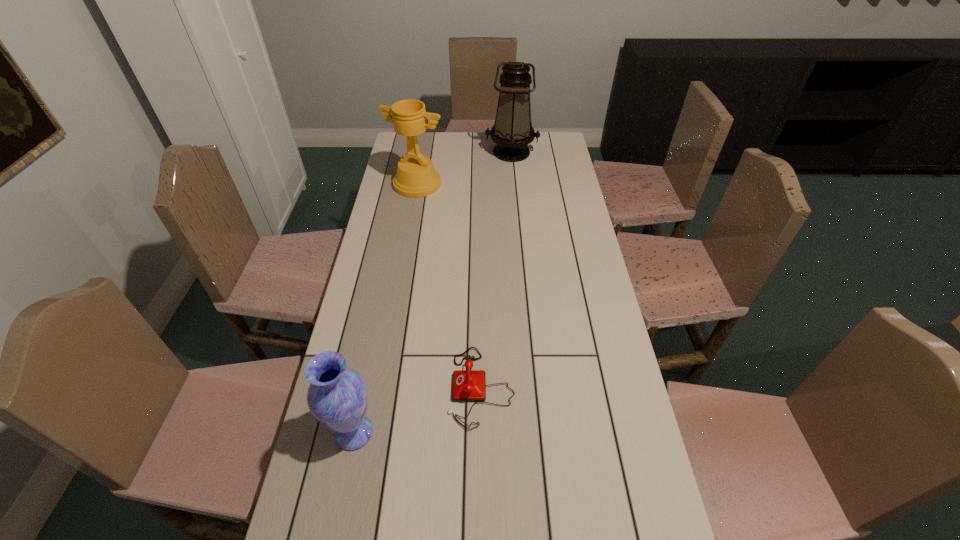
Find the location of a particular element. The height and width of the screenshot is (540, 960). oil lamp is located at coordinates (512, 131).

The image size is (960, 540). In order to click on the farthest object in this screenshot , I will do `click(512, 131)`.

Locate an element on the screen. award is located at coordinates (416, 177).

The width and height of the screenshot is (960, 540). Find the location of `vase`. vase is located at coordinates (337, 397).

Locate an element on the screen. Image resolution: width=960 pixels, height=540 pixels. telephone is located at coordinates (x=469, y=385).

Locate an element on the screen. This screenshot has width=960, height=540. free space located on the front of the farthest object is located at coordinates (515, 190).

The width and height of the screenshot is (960, 540). I want to click on blank space located 0.340m on the right of the award, so click(x=526, y=184).

Where is `vacant space located on the back of the vase`? This screenshot has height=540, width=960. vacant space located on the back of the vase is located at coordinates (374, 334).

The width and height of the screenshot is (960, 540). Find the location of `vacant region located 0.200m on the dial of the telephone`. vacant region located 0.200m on the dial of the telephone is located at coordinates (375, 387).

The image size is (960, 540). I want to click on vacant space located 0.140m on the dial of the telephone, so click(397, 387).